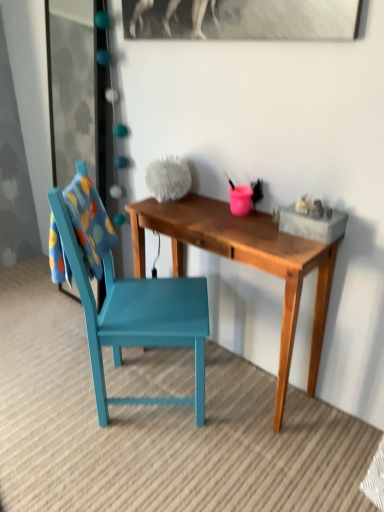
Image resolution: width=384 pixels, height=512 pixels. I want to click on vacant space underneath wooden desk at center (from a real-world perspective), so click(x=233, y=377).